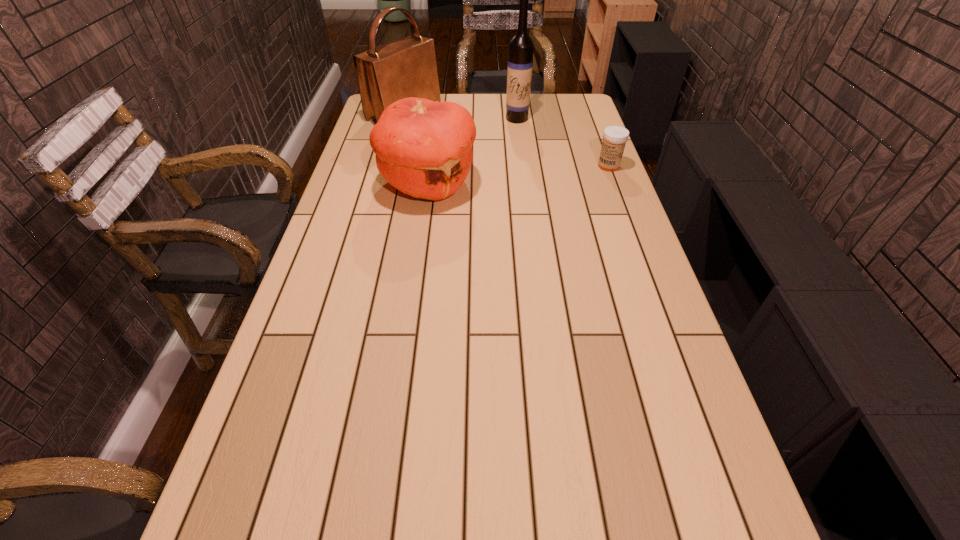
Locate an element on the screen. The width and height of the screenshot is (960, 540). free space on the desktop that is between the third tallest object and the medicine and is positioned on the label of the wine bottle is located at coordinates (496, 177).

This screenshot has width=960, height=540. Identify the location of free space on the desktop that is between the second shortest object and the shortest object and is positioned on the front flap of the shoulder bag. (544, 172).